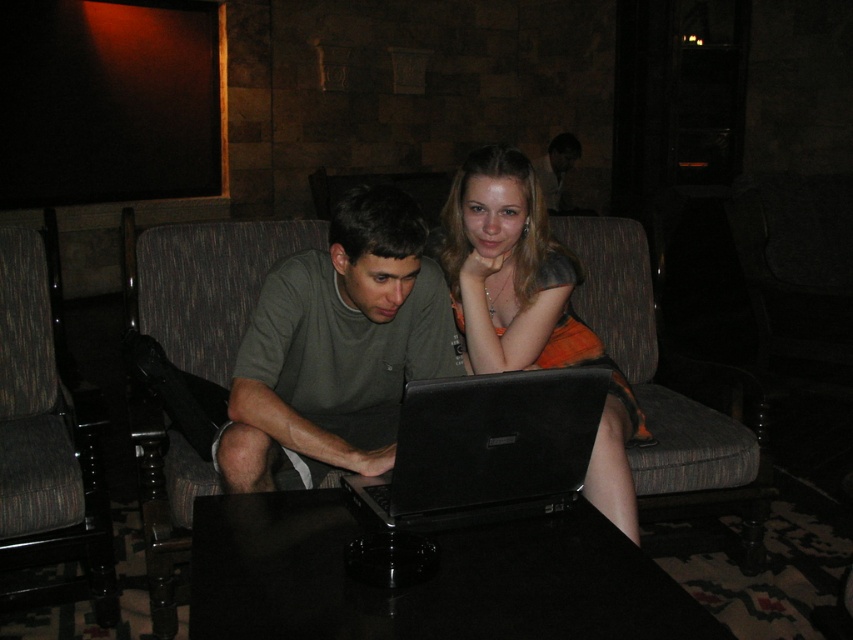
Question: Which point is farther to the camera?

Choices:
 (A) green matte shirt at center
 (B) black matte laptop at center

Answer: (A)

Question: Does matte black laptop at center lie in front of dark brown fabric armchair at left?

Choices:
 (A) no
 (B) yes

Answer: (B)

Question: Can you confirm if dark gray fabric armchair at left is positioned above black matte laptop at center?

Choices:
 (A) no
 (B) yes

Answer: (B)

Question: Which object appears closest to the camera in this image?

Choices:
 (A) green matte shirt at center
 (B) black glossy table at center

Answer: (B)

Question: Based on their relative distances, which object is farther from the dark brown leather jacket at upper center?

Choices:
 (A) black matte laptop at center
 (B) green matte shirt at center

Answer: (A)

Question: Does matte black laptop at center appear under green matte shirt at center?

Choices:
 (A) yes
 (B) no

Answer: (B)